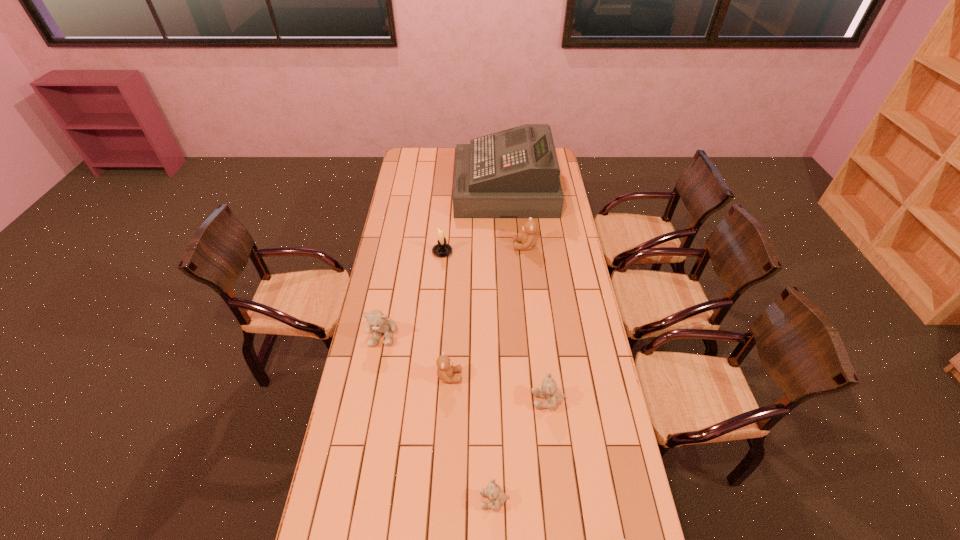
Image resolution: width=960 pixels, height=540 pixels. I want to click on cash register that is at the right edge, so coord(514,173).

Locate an element on the screen. Image resolution: width=960 pixels, height=540 pixels. teddy bear at the right edge is located at coordinates (548, 390).

The image size is (960, 540). Identify the location of object situated at the far right corner. (514, 173).

Locate an element on the screen. free region at the far edge of the desktop is located at coordinates (454, 158).

Identify the location of free space at the left edge of the desktop. This screenshot has height=540, width=960. (397, 200).

The image size is (960, 540). Find the location of `vacant space at the right edge of the desktop`. vacant space at the right edge of the desktop is located at coordinates (602, 417).

You are a GUI agent. You are given a task and a screenshot of the screen. Output one action in this format:
    pyautogui.click(x=<x>, y=<y>)
    Task: Click on the blank space at the far left corner of the desktop
    The width and height of the screenshot is (960, 540).
    Given the screenshot: What is the action you would take?
    pyautogui.click(x=406, y=154)

Locate an element on the screen. The image size is (960, 540). free space between the leftmost teddy bear and the cash register is located at coordinates (444, 261).

Identify the location of free space between the second teddy bear from left to right and the second farthest teddy bear. (416, 355).

Find the location of a particular element. The height and width of the screenshot is (540, 960). vacant space that's between the fourth teddy bear from right to left and the fourth nearest object is located at coordinates (471, 438).